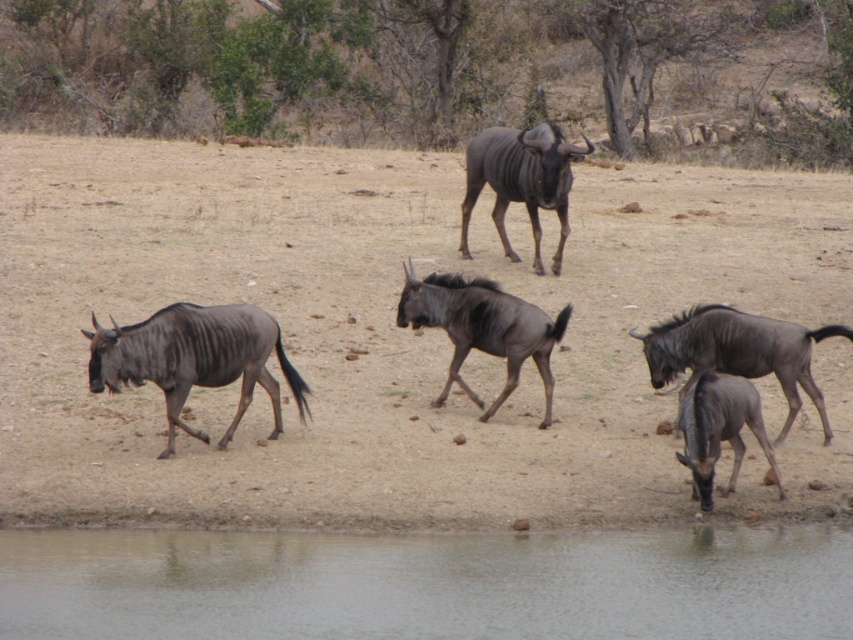
Measure the distance between transparent water at lower center and dark brown fur at right.

The distance of transparent water at lower center from dark brown fur at right is 2.08 meters.

Can you confirm if transparent water at lower center is positioned to the right of dark brown fur at right?

No, transparent water at lower center is not to the right of dark brown fur at right.

Who is more forward, (433, 580) or (772, 348)?

Positioned in front is point (433, 580).

This screenshot has width=853, height=640. Identify the location of transparent water at lower center. coord(428,584).

Can you confirm if brown matte/glossy wildebeest at left is wider than dark brown fur at right?

In fact, brown matte/glossy wildebeest at left might be narrower than dark brown fur at right.

Is brown matte/glossy wildebeest at left to the left of dark brown fur at right from the viewer's perspective?

Yes, brown matte/glossy wildebeest at left is to the left of dark brown fur at right.

What do you see at coordinates (194, 358) in the screenshot?
I see `brown matte/glossy wildebeest at left` at bounding box center [194, 358].

Locate an element on the screen. This screenshot has height=640, width=853. brown matte/glossy wildebeest at left is located at coordinates (194, 358).

Who is positioned more to the right, transparent water at lower center or dark brown fur at center?

From the viewer's perspective, dark brown fur at center appears more on the right side.

Does transparent water at lower center come behind dark brown fur at center?

No, transparent water at lower center is closer to the viewer.

Is point (282, 600) positioned after point (512, 252)?

That is False.

Where is `transparent water at lower center`? The image size is (853, 640). transparent water at lower center is located at coordinates (428, 584).